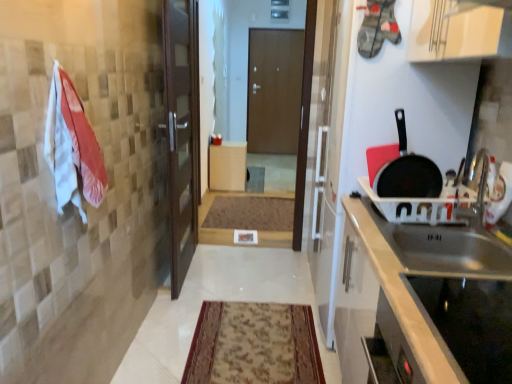
Find the location of a particular element. The width and height of the screenshot is (512, 384). free space above carpeted rug at center, the 1th mat from the front (from a real-world perspective) is located at coordinates (257, 336).